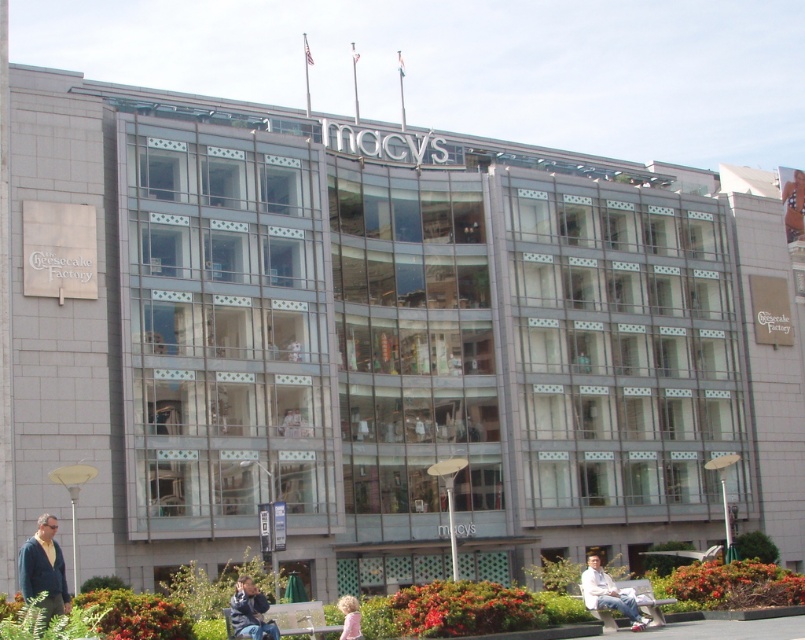
Between light blue jeans at lower right and blue denim jeans at lower center, which one appears on the right side from the viewer's perspective?

light blue jeans at lower right

Looking at this image, which is above, light blue jeans at lower right or blue denim jeans at lower center?

blue denim jeans at lower center is above.

Between point (632, 612) and point (259, 628), which one is positioned in front?

Positioned in front is point (259, 628).

I want to click on light blue jeans at lower right, so click(x=609, y=593).

Is blue denim jeans at lower center below blonde hair at lower center?

No.

The height and width of the screenshot is (640, 805). Find the location of `blue denim jeans at lower center`. blue denim jeans at lower center is located at coordinates (250, 611).

Where is `blue denim jeans at lower center`? blue denim jeans at lower center is located at coordinates (250, 611).

Who is more distant from viewer, (46, 534) or (593, 576)?

Positioned behind is point (593, 576).

Who is more forward, (52,600) or (621,596)?

Positioned in front is point (52,600).

Is point (62, 576) behind point (587, 576)?

No.

The width and height of the screenshot is (805, 640). Identify the location of dark blue sweater at lower left. (43, 568).